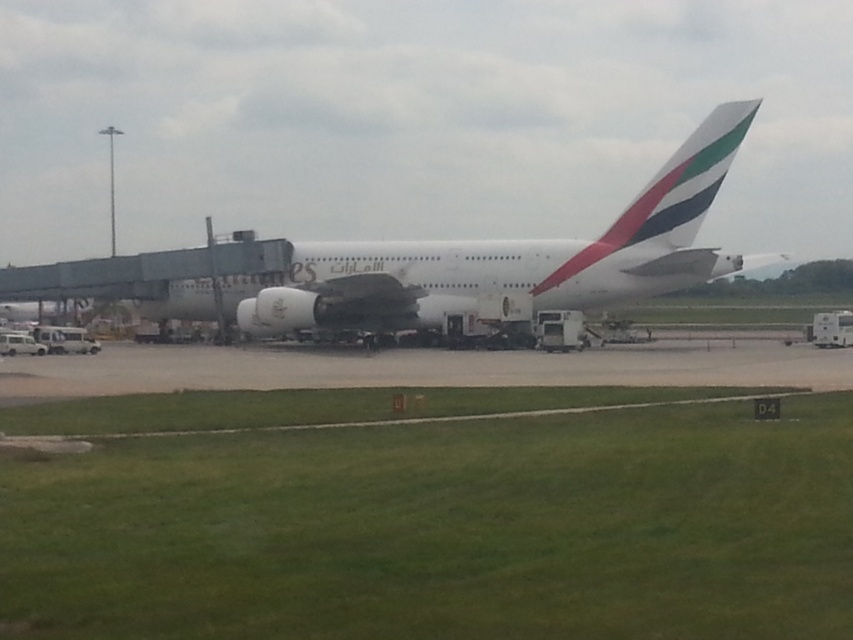
You are a maintenance worker inspecting an Emirates Airlines Airbus A380. You notice the white glossy tail at center and the metallic silver jet engine at center. Which object is positioned closer to your current viewpoint?

The white glossy tail at center is closer to the viewer than the metallic silver jet engine at center.

You are a maintenance worker at the airport. You need to inspect both the white glossy airplane at center and the metallic silver jet engine at center. Which object should you prioritize inspecting first if you can only handle one large object at a time?

The white glossy airplane at center should be prioritized because it has a larger size compared to the metallic silver jet engine at center, making it the more critical object to inspect first.

You are a ground crew member standing at point (260, 317). You need to walk to the aircraft door, which is located at point (436, 262). Is the door in front of or behind you relative to your current position?

The door at point (436, 262) is behind point (260, 317), so the door is behind you relative to your current position.